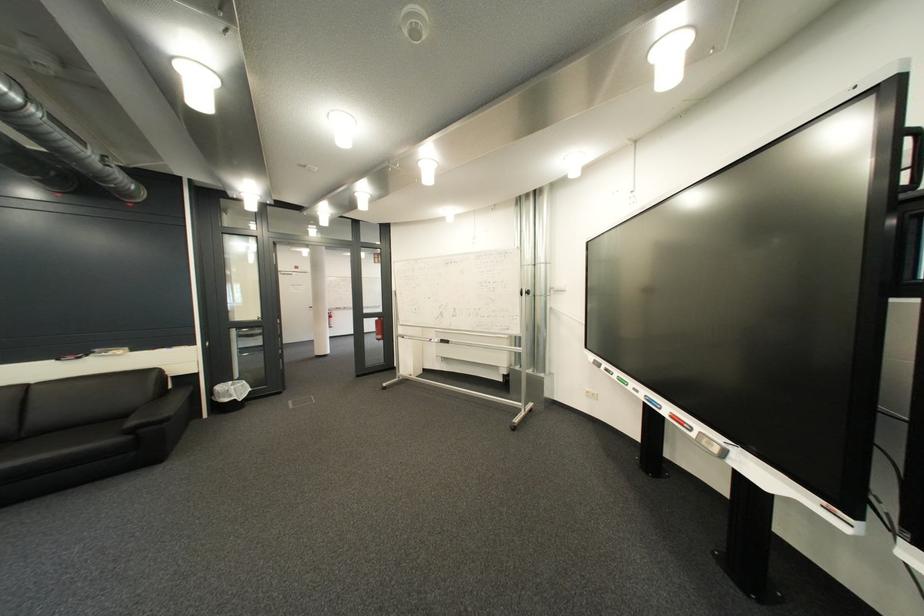
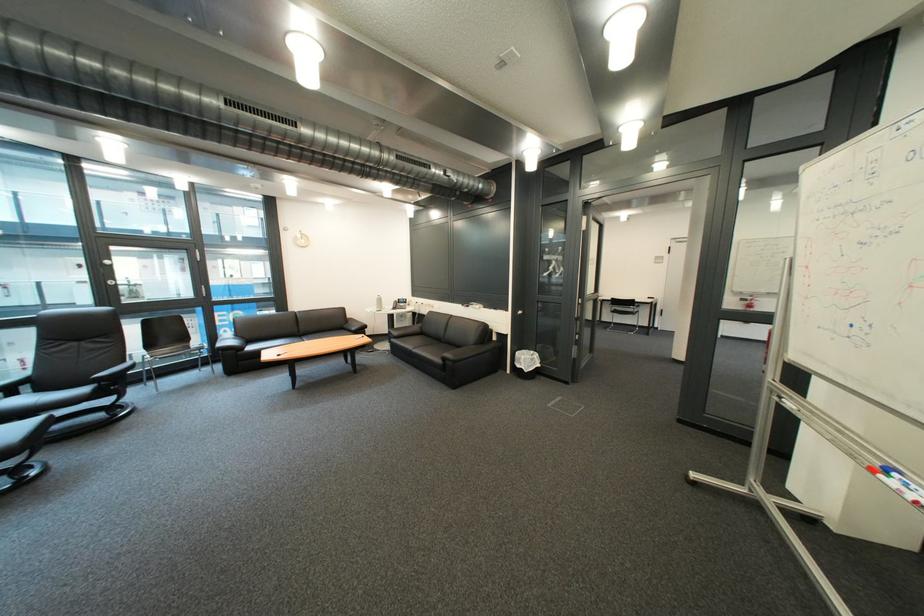
The point at (144,432) is marked in the first image. Where is the corresponding point in the second image?

(457, 361)